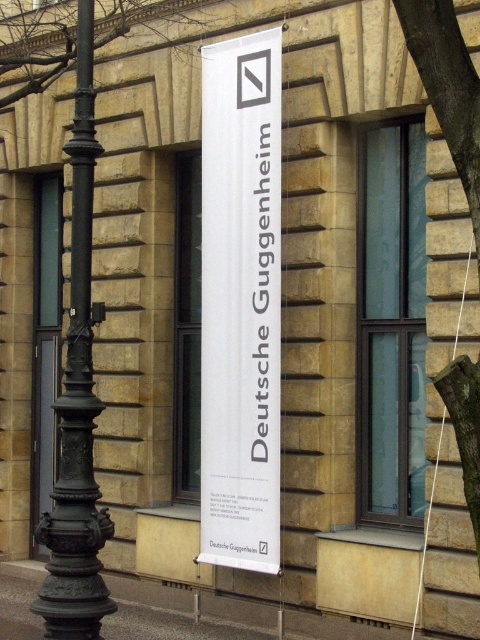
Is white paper banner at center smaller than black cast iron pole at left?

Actually, white paper banner at center might be larger than black cast iron pole at left.

Is white paper banner at center shorter than black cast iron pole at left?

In fact, white paper banner at center may be taller than black cast iron pole at left.

Does point (278, 330) come farther from viewer compared to point (91, 605)?

Yes, it is.

You are a GUI agent. You are given a task and a screenshot of the screen. Output one action in this format:
    pyautogui.click(x=<x>, y=<y>)
    Task: Click on the white paper banner at center
    
    Given the screenshot: What is the action you would take?
    pyautogui.click(x=240, y=301)